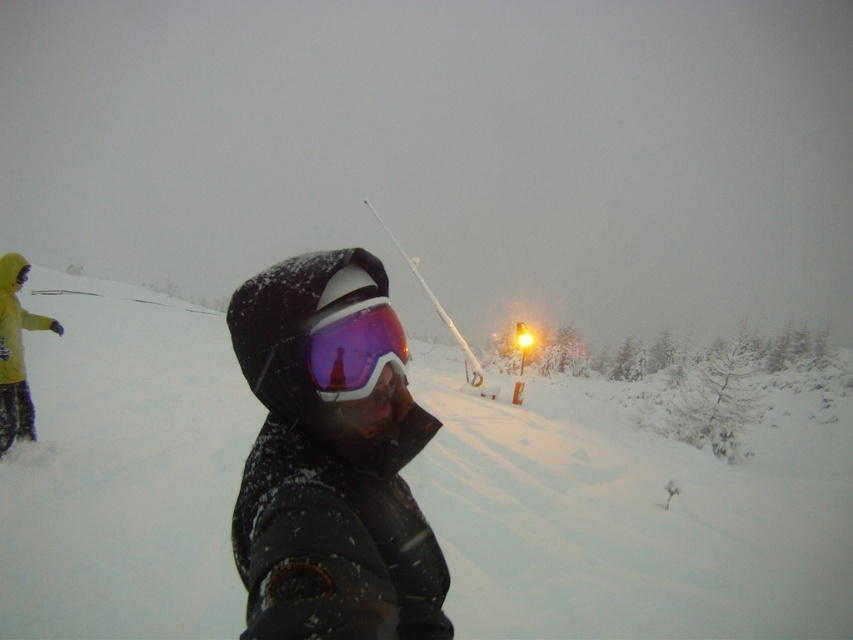
You are a photographer trying to capture both the purple reflective goggles at center and the yellow fabric pants at left in the same frame. Based on their positions, which object should you adjust your camera to focus on first to ensure both are in the shot?

The purple reflective goggles at center is positioned on the right side of yellow fabric pants at left. To include both in the frame, focus on the yellow fabric pants at left first since it is on the left, then adjust the camera to include the purple reflective goggles at center on the right.

You are a photographer trying to capture the perfect shot of the white fluffy snow at center and the purple reflective goggles at center. Which object should you focus on first if you want to ensure both are in sharp focus?

The white fluffy snow at center is taller than the purple reflective goggles at center, so focusing on the white fluffy snow at center first will help ensure both objects are in sharp focus since it is the taller object.

You are a photographer positioned at the scene described. You want to capture a closeup shot of the matte black jacket at center without including the person in the bright yellow jacket in the background. Given your current position, is the distance sufficient to ensure the yellow jacket is out of frame?

The matte black jacket at center is 36.91 inches away from viewer. Since the yellow jacket wearer is further back, maintaining this distance while focusing on the matte black jacket should keep the yellow jacket out of the frame.